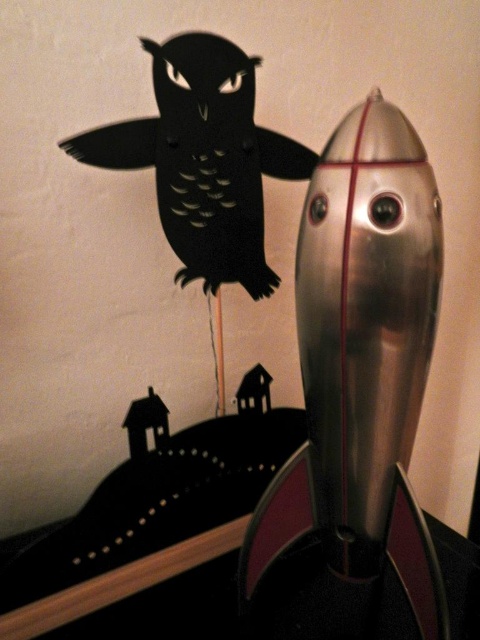
Is shiny metallic rocket at right shorter than black paper owl at upper left?

In fact, shiny metallic rocket at right may be taller than black paper owl at upper left.

Which is above, shiny metallic rocket at right or black paper owl at upper left?

black paper owl at upper left

Is point (363, 276) positioned in front of point (233, 216)?

Yes, it is in front of point (233, 216).

Image resolution: width=480 pixels, height=640 pixels. In order to click on shiny metallic rocket at right in this screenshot , I will do [x=356, y=401].